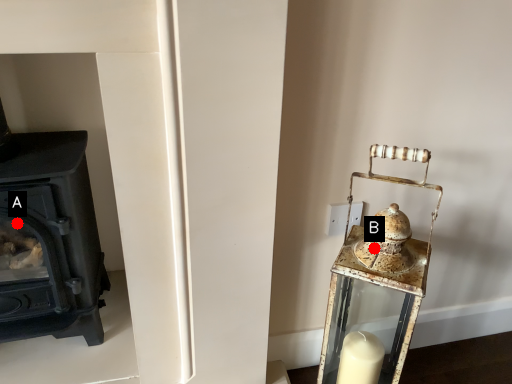
Question: Two points are circled on the image, labeled by A and B beside each circle. Which point appears farthest from the camera in this image?

Choices:
 (A) A is further
 (B) B is further

Answer: (A)